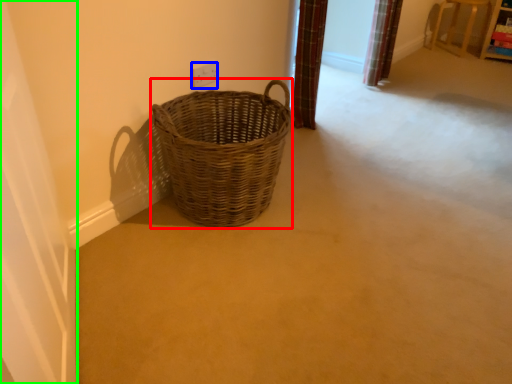
Question: Which is farther away from picnic basket (highlighted by a red box)? electric outlet (highlighted by a blue box) or screen door (highlighted by a green box)?

Choices:
 (A) electric outlet
 (B) screen door

Answer: (B)